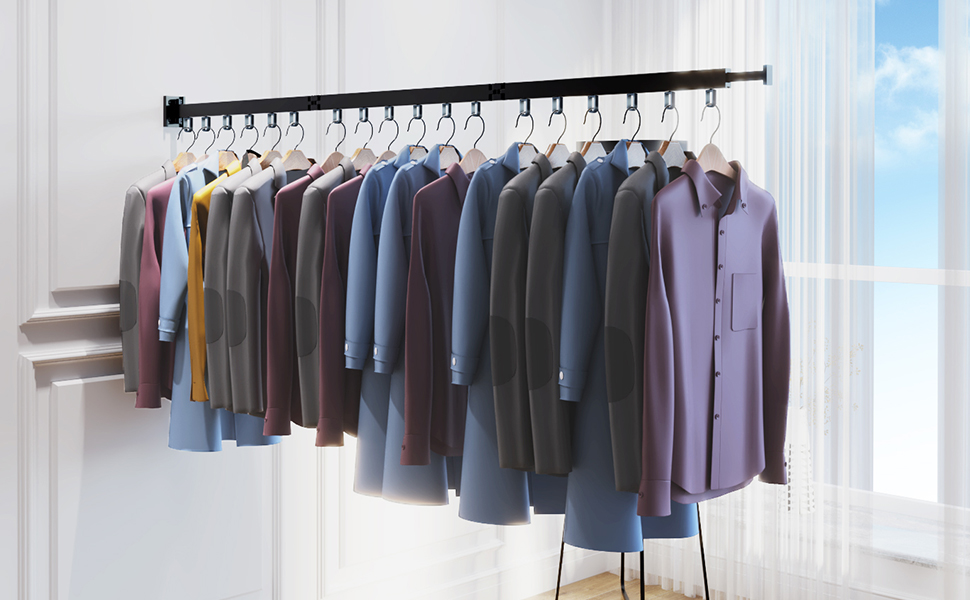
The width and height of the screenshot is (970, 600). I want to click on wall panels, so click(x=406, y=555), click(x=217, y=547), click(x=85, y=289), click(x=397, y=70).